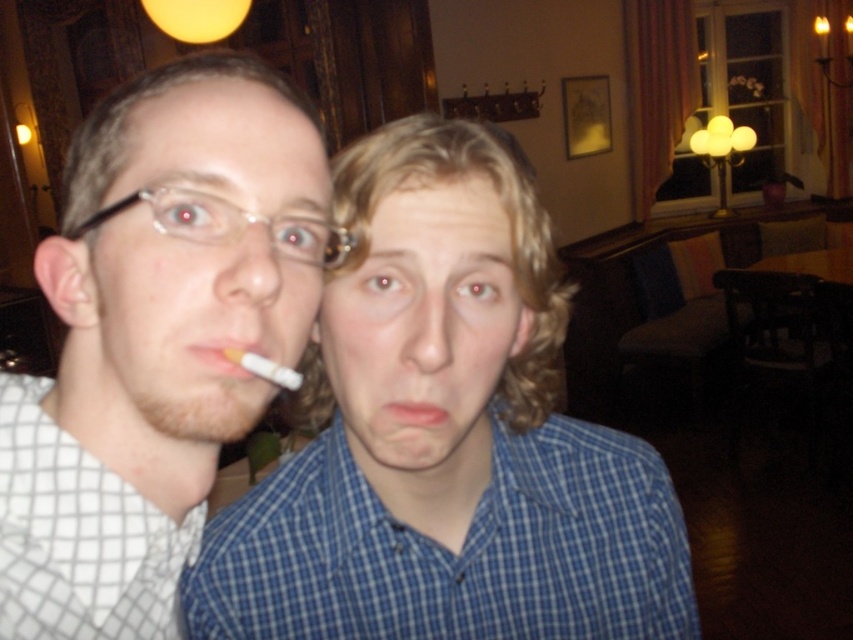
Can you confirm if yellow matte cigarette at center is positioned above pink matte lips at center?

Yes, yellow matte cigarette at center is above pink matte lips at center.

Can you confirm if yellow matte cigarette at center is wider than pink matte lips at center?

Yes, yellow matte cigarette at center is wider than pink matte lips at center.

In order to click on yellow matte cigarette at center in this screenshot , I will do `click(227, 355)`.

Who is lower down, white checkered shirt at left or pink matte lips at center?

pink matte lips at center is below.

Can you confirm if white checkered shirt at left is positioned below pink matte lips at center?

No.

Locate an element on the screen. Image resolution: width=853 pixels, height=640 pixels. white checkered shirt at left is located at coordinates (155, 337).

Where is `white checkered shirt at left`? The width and height of the screenshot is (853, 640). white checkered shirt at left is located at coordinates (155, 337).

Is white checkered shirt at left taller than yellow matte cigarette at center?

Yes.

Locate an element on the screen. This screenshot has width=853, height=640. white checkered shirt at left is located at coordinates (155, 337).